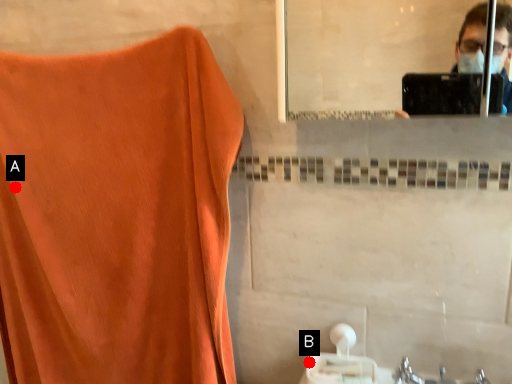
Question: Two points are circled on the image, labeled by A and B beside each circle. Which point appears closest to the camera in this image?

Choices:
 (A) A is closer
 (B) B is closer

Answer: (B)